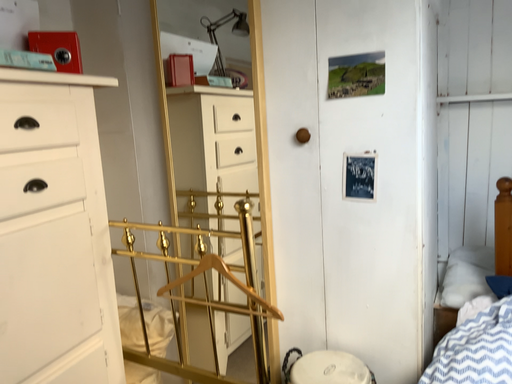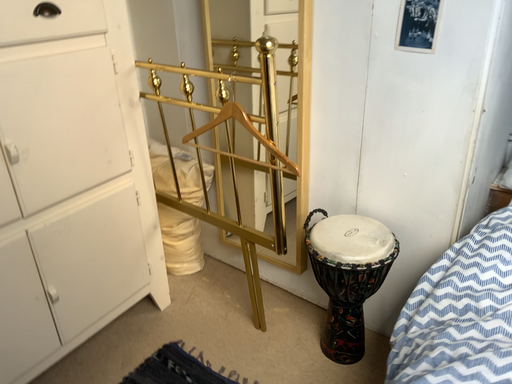
Question: Which way did the camera rotate in the video?

Choices:
 (A) rotated right
 (B) rotated left

Answer: (B)